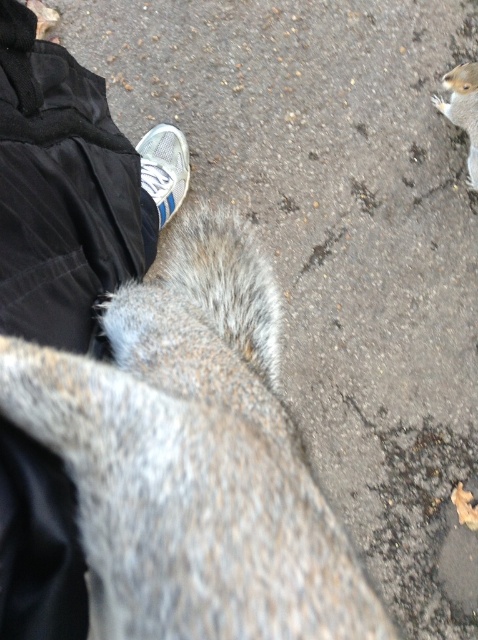
You are a small animal trying to cross the path between the white mesh shoe at center and the gray furry squirrel at upper right. Can you fit through the space between them?

The white mesh shoe at center might be wider than gray furry squirrel at upper right, so there might not be enough space for the small animal to fit through the path between them.

You are a photographer trying to capture both the black fabric shoe at lower left and the white mesh shoe at center in a single frame. Which shoe should you adjust your camera angle to focus on first to ensure both are in the shot?

The black fabric shoe at lower left is positioned on the right side of white mesh shoe at center. To capture both in a single frame, focus on the white mesh shoe at center first since it is closer to the center of the frame, allowing the black fabric shoe at lower left to naturally fall into the composition on its right side.

You are a photographer trying to capture both the squirrel near the person and the one on the right side. The camera you are using has a limited field of view. Given that the white mesh shoe at center is at point (164,168), which is the central focus point, where should you position your camera to ensure both squirrels are in frame?

To capture both squirrels while keeping the white mesh shoe at center as the focal point, position the camera so that the central focus point aligns with the white mesh shoe at center. This ensures the shoe remains centered while the camera angle includes the nearby squirrel and the one on the right within the field of view.